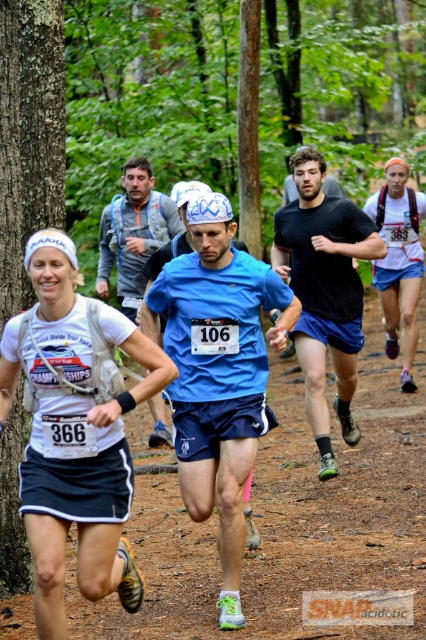
Question: Is white fabric shirt at left in front of black matte running shoe at center?

Choices:
 (A) yes
 (B) no

Answer: (A)

Question: Which of these objects is positioned farthest from the black matte running shoe at center?

Choices:
 (A) white fabric shirt at left
 (B) blue fabric shirt at center

Answer: (A)

Question: Which of the following is the closest to the observer?

Choices:
 (A) (305, 380)
 (B) (71, 518)

Answer: (B)

Question: Which point is farther from the camera taking this photo?

Choices:
 (A) (294, 220)
 (B) (132, 166)
 (C) (83, 545)

Answer: (B)

Question: Is black matte running shoe at center wider than blue fabric shirt at center?

Choices:
 (A) yes
 (B) no

Answer: (B)

Question: Does white fabric shirt at left come in front of blue fabric shirt at center?

Choices:
 (A) no
 (B) yes

Answer: (B)